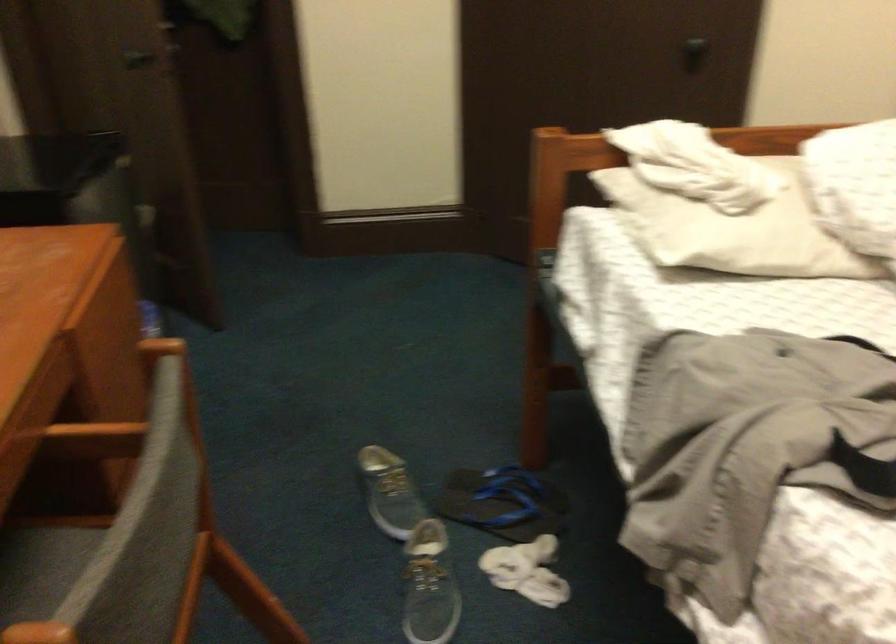
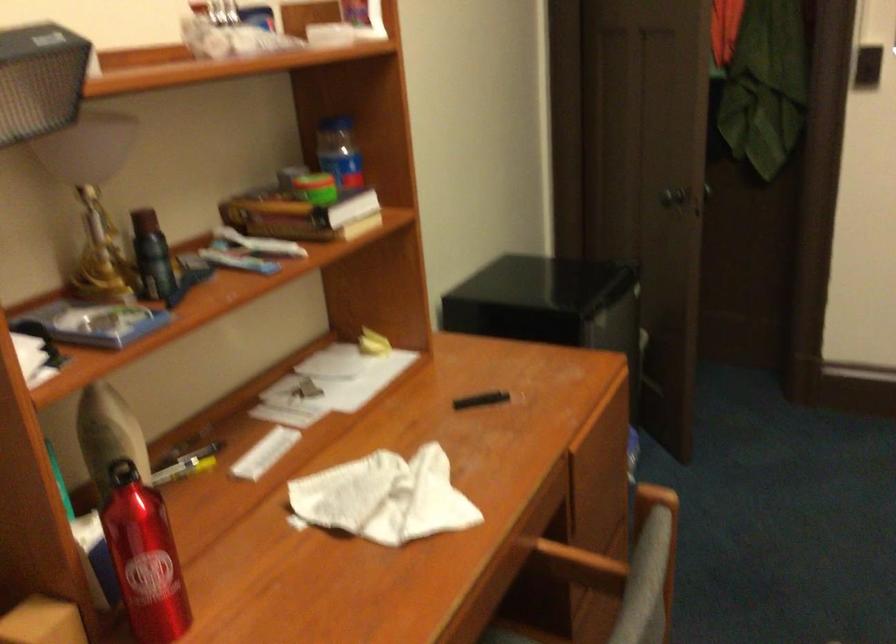
Question: The images are taken continuously from a first-person perspective. In which direction is your viewpoint rotating?

Choices:
 (A) Left
 (B) Right
 (C) Up
 (D) Down

Answer: (A)